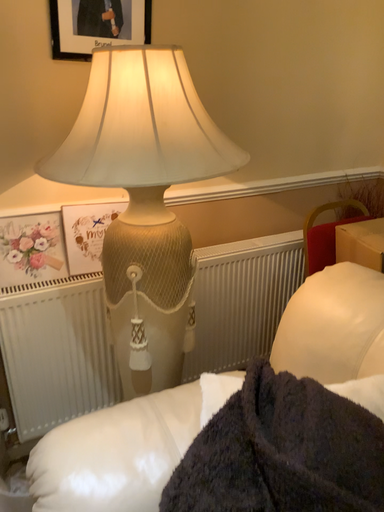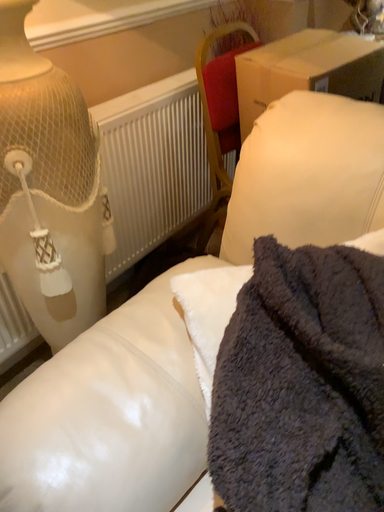
Question: How did the camera likely rotate when shooting the video?

Choices:
 (A) rotated left
 (B) rotated right

Answer: (B)